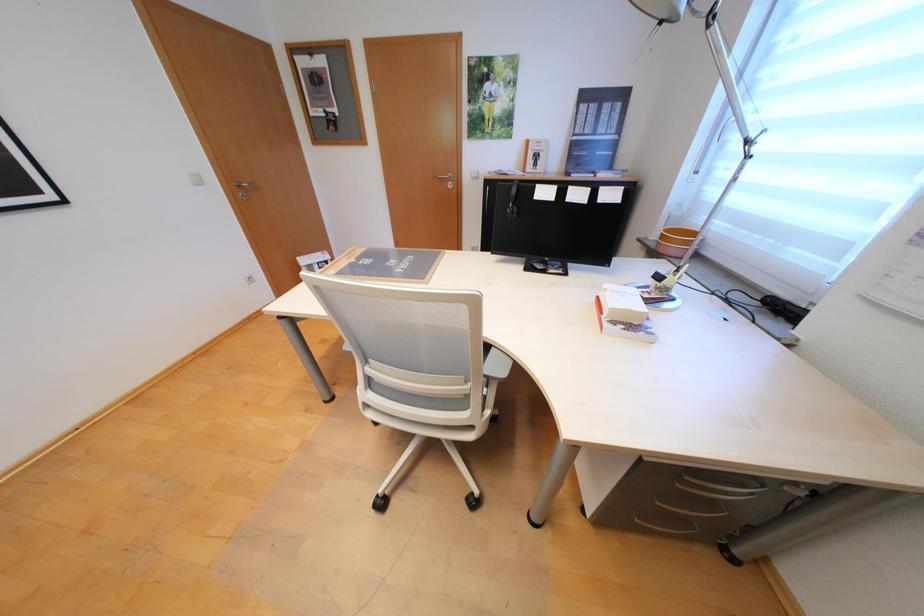
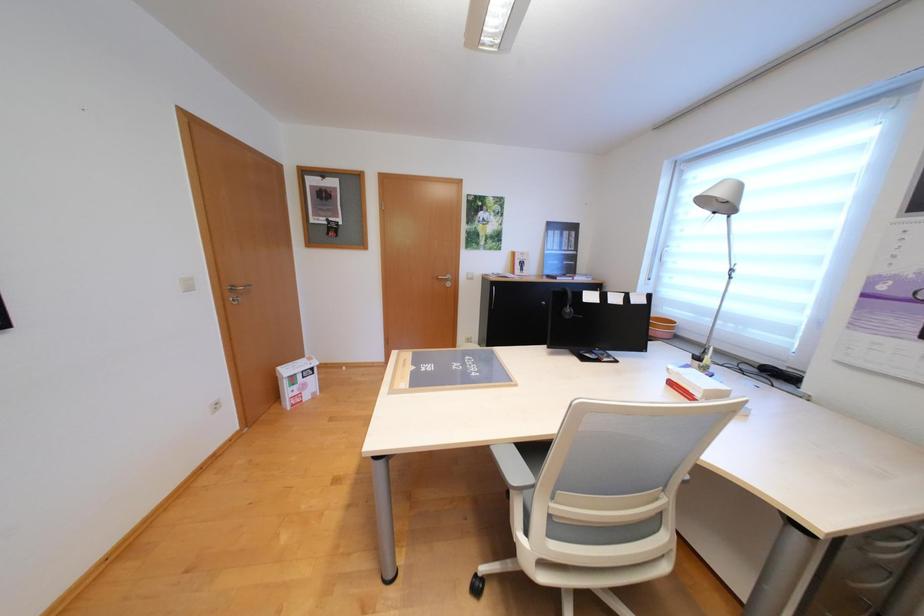
Question: Which direction would the cameraman need to move to produce the second image? Reply with the corresponding letter.

Choices:
 (A) Left
 (B) Right
 (C) Forward
 (D) Backward

Answer: (A)